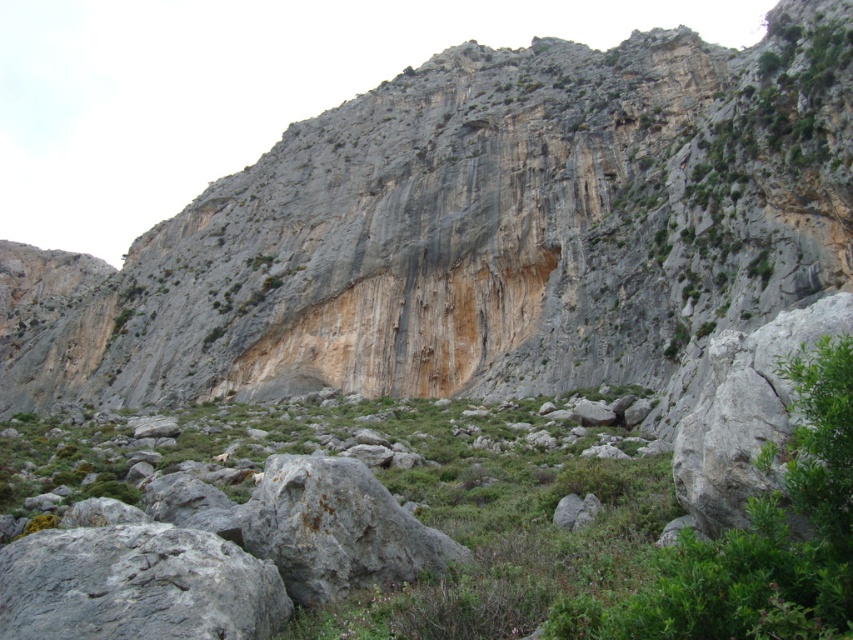
You are a hiker standing at the base of the cliff and want to reach the top. You notice two points marked on the cliff face. Which point is closer to you, point (757, 627) or point (61, 548)?

Point (757, 627) is closer to the viewer than point (61, 548), so the hiker should head towards point (757, 627) first.

You are a geologist examining the mountainous landscape. You have a point marked at coordinates (476, 230). Based on the scene description, what type of terrain is this point located on?

The point is located on a gray rock formation at center.

You are a hiker trying to navigate through the mountainous area. You see the gray rock formation at center and the green leafy bush at center. Which one would you need to look up to see from your current position?

The gray rock formation at center is much taller than the green leafy bush at center, so you would need to look up to see the gray rock formation at center from your current position.